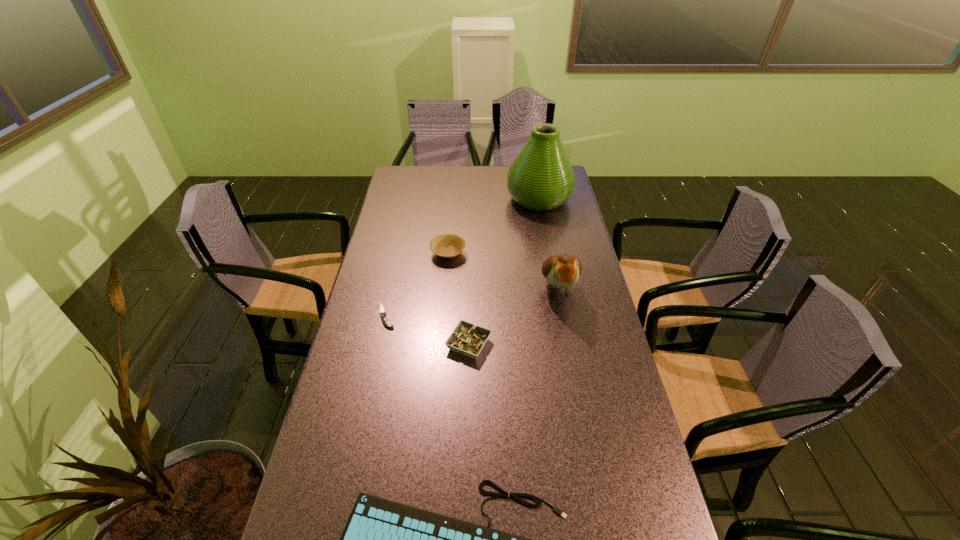
At what (x,y) coordinates should I click in order to perform the action: click on object that is the closest to the vase. Please return your answer as a coordinate pair (x, y). The height and width of the screenshot is (540, 960). Looking at the image, I should click on [447, 246].

Locate an element on the screen. object that is the fourth closest to the second farthest object is located at coordinates (467, 339).

Identify the location of blank area in the image that satisfies the following two spatial constraints: 1. on the back side of the fourth shortest object; 2. on the right side of the vase. The image size is (960, 540). (453, 199).